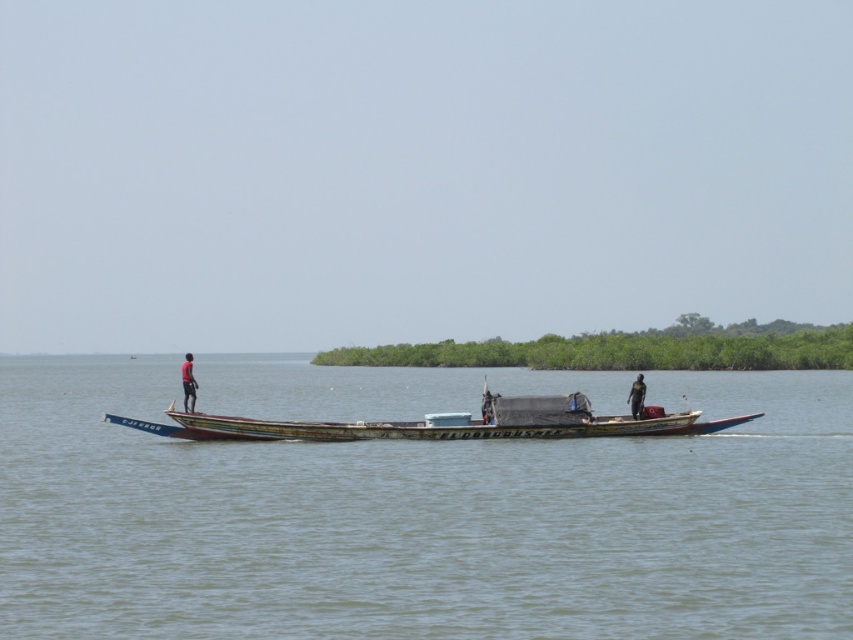
You are a safety inspector on a boat and need to ensure that the greenish water at center is at least 50 meters away from the dark skin human at center for safety regulations. Based on the image, is the current distance compliant with the requirement?

The distance between the greenish water at center and the dark skin human at center is 42.22 meters, which is less than the required 50 meters. Therefore, the current distance does not comply with the safety regulations.

You are standing on the boat and see the point at coordinates [421,520]. What is the location of this point relative to the boat?

The point at coordinates [421,520] is located on the greenish water at center, which is part of the calm waters where the boat is navigating.

You are standing on the dock and want to throw a lifebuoy to the person closest to the camera. The coordinates of the lifebuoy are point (202, 540). Which person should you aim for?

The point (202, 540) is 20.09 meters from the camera, so you should aim for the person at the stern since they are closer to the camera than the person at the bow.